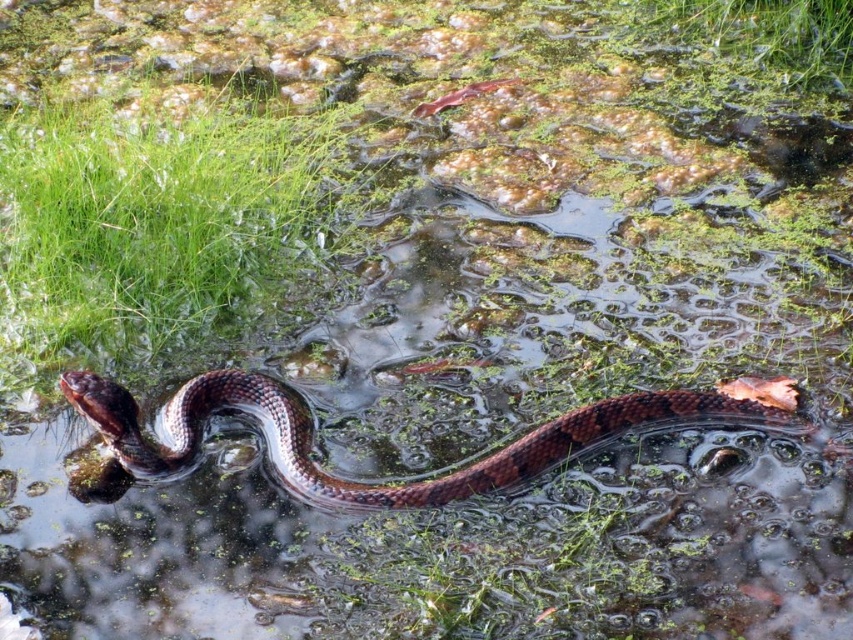
Describe the element at coordinates (386, 484) in the screenshot. I see `shiny brown snake at center` at that location.

Where is `shiny brown snake at center`? The height and width of the screenshot is (640, 853). shiny brown snake at center is located at coordinates (386, 484).

This screenshot has height=640, width=853. Describe the element at coordinates (149, 220) in the screenshot. I see `green grass at left` at that location.

Is point (222, 195) farther from viewer compared to point (96, 408)?

Yes.

I want to click on green grass at left, so click(x=149, y=220).

I want to click on green grass at left, so click(149, 220).

I want to click on green grass at left, so click(x=149, y=220).

Between green grass at left and green matte grass at upper center, which one appears on the right side from the viewer's perspective?

Positioned to the right is green matte grass at upper center.

Is point (65, 150) positioned behind point (844, 68)?

No, it is in front of (844, 68).

The width and height of the screenshot is (853, 640). In order to click on green grass at left in this screenshot , I will do `click(149, 220)`.